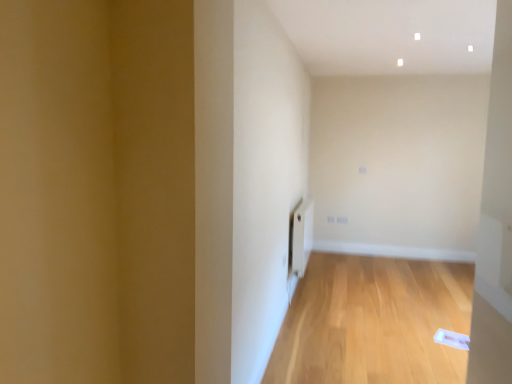
Identify the location of free spot to the right of white matte radiator at center. The width and height of the screenshot is (512, 384). (373, 286).